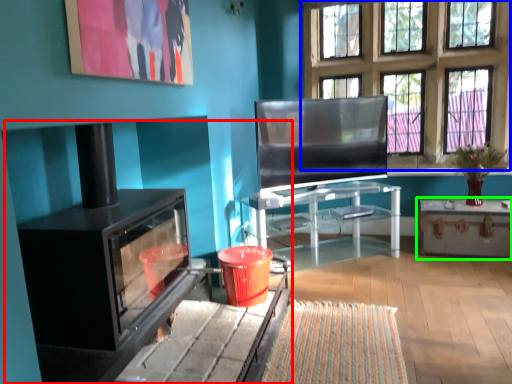
Question: Considering the real-world distances, which object is closest to fireplace (highlighted by a red box)? window (highlighted by a blue box) or table (highlighted by a green box).

Choices:
 (A) window
 (B) table

Answer: (B)